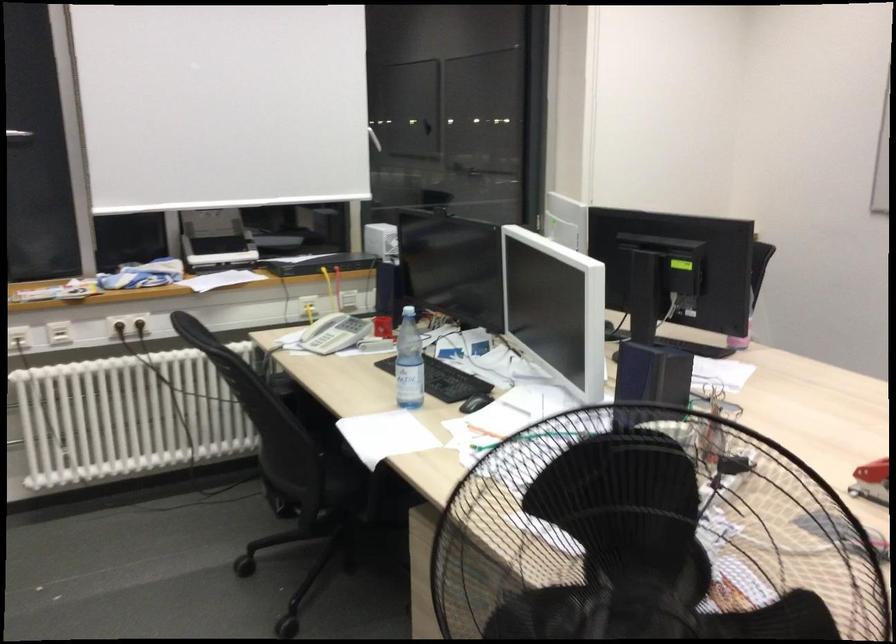
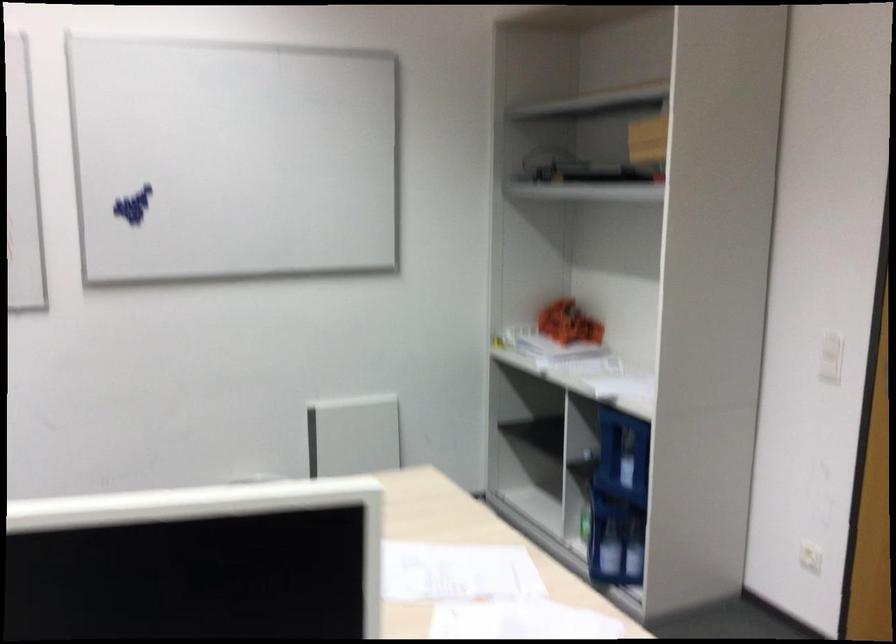
Question: How did the camera likely rotate?

Choices:
 (A) Left
 (B) Right
 (C) Up
 (D) Down

Answer: (B)